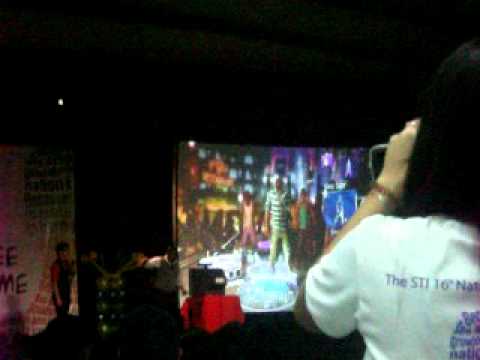
Find the location of a particular element. black box on red tablecloth is located at coordinates (201, 279).